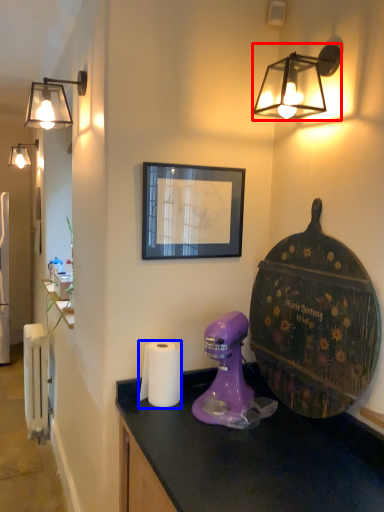
Question: Which of the following is the farthest to the observer, lamp (highlighted by a red box) or toilet paper (highlighted by a blue box)?

Choices:
 (A) lamp
 (B) toilet paper

Answer: (B)